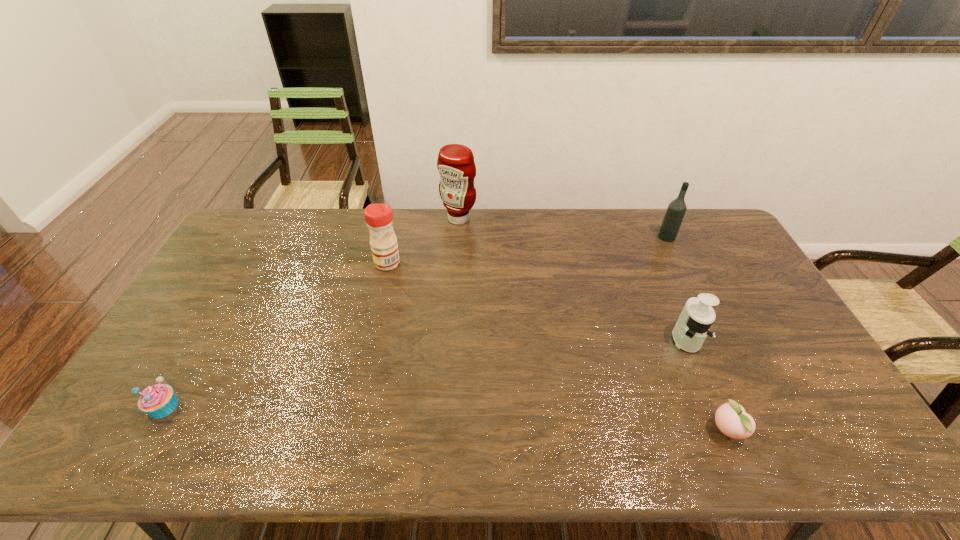
I want to click on vacant space that is in between the muffin and the fourth nearest object, so click(276, 335).

What are the coordinates of `free space between the peach and the muffin` in the screenshot? It's located at coord(445,418).

This screenshot has width=960, height=540. I want to click on vacant space that is in between the juicer and the muffin, so click(x=424, y=373).

You are a GUI agent. You are given a task and a screenshot of the screen. Output one action in this format:
    pyautogui.click(x=<x>, y=<y>)
    Task: Click on the unoccupied position between the fifth nearest object and the second object from left to right
    This screenshot has width=960, height=540.
    Given the screenshot: What is the action you would take?
    pyautogui.click(x=527, y=250)

Where is `the fourth closest object to the farthest object`? the fourth closest object to the farthest object is located at coordinates (158, 401).

Identify the location of object that is the second closest to the fifth object from right to left. (158, 401).

At what (x,y) coordinates should I click in order to perform the action: click on vacant space that satisfies the following two spatial constraints: 1. on the back side of the leftmost object; 2. on the left side of the second farthest object. Please return your answer as a coordinate pair (x, y). This screenshot has height=540, width=960. Looking at the image, I should click on (260, 237).

I want to click on vacant point that satisfies the following two spatial constraints: 1. on the front side of the peach; 2. on the right side of the fourth object from right to left, so (x=446, y=430).